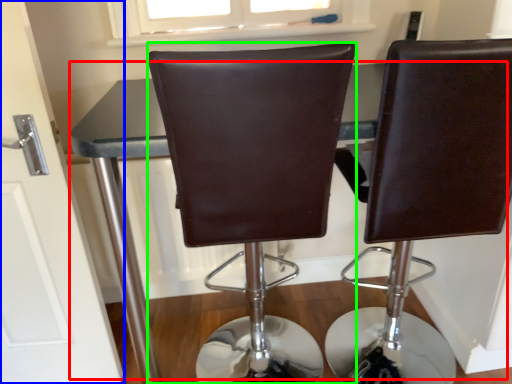
Question: Considering the real-world distances, which object is closest to table (highlighted by a red box)? door (highlighted by a blue box) or chair (highlighted by a green box).

Choices:
 (A) door
 (B) chair

Answer: (A)